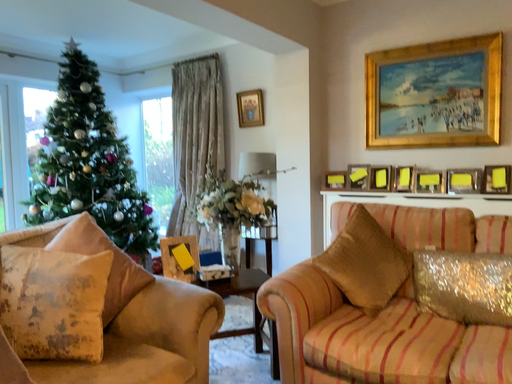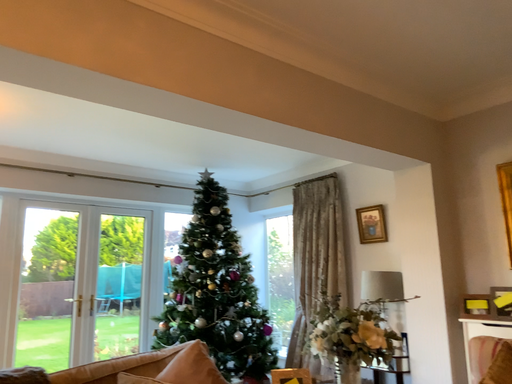
Question: Which way did the camera rotate in the video?

Choices:
 (A) rotated left
 (B) rotated right

Answer: (A)